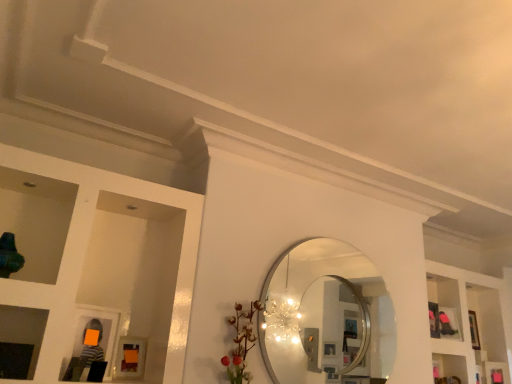
Question: Is white glossy shelves at upper right outside matte orange picture frame at lower left?

Choices:
 (A) no
 (B) yes

Answer: (B)

Question: From a real-world perspective, does white glossy shelves at upper right stand above matte orange picture frame at lower left?

Choices:
 (A) yes
 (B) no

Answer: (A)

Question: Can you confirm if white glossy shelves at upper right is wider than matte orange picture frame at lower left?

Choices:
 (A) no
 (B) yes

Answer: (B)

Question: Is white glossy shelves at upper right to the left of matte orange picture frame at lower left from the viewer's perspective?

Choices:
 (A) yes
 (B) no

Answer: (B)

Question: Is white glossy shelves at upper right closer to camera compared to matte orange picture frame at lower left?

Choices:
 (A) yes
 (B) no

Answer: (B)

Question: Does white glossy shelves at upper right have a larger size compared to matte orange picture frame at lower left?

Choices:
 (A) yes
 (B) no

Answer: (A)

Question: From a real-world perspective, is matte orange picture frame at lower left on white glossy shelves at upper right?

Choices:
 (A) no
 (B) yes

Answer: (A)

Question: Is matte orange picture frame at lower left smaller than white glossy shelves at upper right?

Choices:
 (A) yes
 (B) no

Answer: (A)

Question: From a real-world perspective, is matte orange picture frame at lower left below white glossy shelves at upper right?

Choices:
 (A) yes
 (B) no

Answer: (A)

Question: Is white glossy shelves at upper right at the back of matte orange picture frame at lower left?

Choices:
 (A) no
 (B) yes

Answer: (A)

Question: Is matte orange picture frame at lower left far from white glossy shelves at upper right?

Choices:
 (A) no
 (B) yes

Answer: (B)

Question: From the image's perspective, is matte orange picture frame at lower left located beneath white glossy shelves at upper right?

Choices:
 (A) no
 (B) yes

Answer: (A)

Question: Is white glossy shelves at upper right at the left side of silver metallic mirror at center?

Choices:
 (A) no
 (B) yes

Answer: (A)